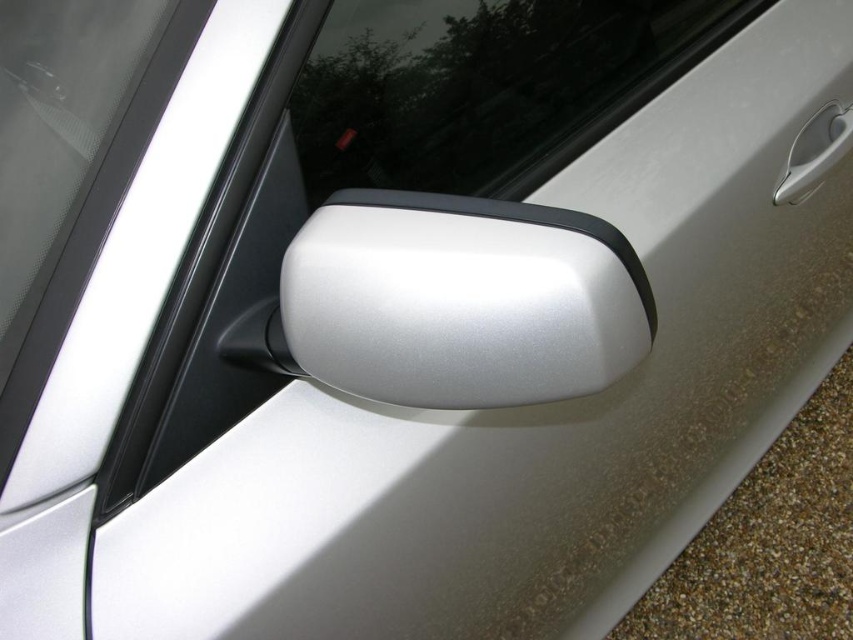
Question: In this image, where is satin silver side mirror at center located relative to transparent glass at upper center?

Choices:
 (A) right
 (B) left

Answer: (B)

Question: Estimate the real-world distances between objects in this image. Which object is closer to the satin silver side mirror at center?

Choices:
 (A) transparent glass at upper center
 (B) satin silver door handle at upper right

Answer: (A)

Question: Estimate the real-world distances between objects in this image. Which object is closer to the transparent glass at upper center?

Choices:
 (A) satin silver door handle at upper right
 (B) satin silver side mirror at center

Answer: (B)

Question: Which point is closer to the camera?

Choices:
 (A) satin silver side mirror at center
 (B) transparent glass at upper center

Answer: (A)

Question: Is the position of transparent glass at upper center less distant than that of satin silver door handle at upper right?

Choices:
 (A) yes
 (B) no

Answer: (A)

Question: Can you confirm if satin silver side mirror at center is positioned to the left of satin silver door handle at upper right?

Choices:
 (A) no
 (B) yes

Answer: (B)